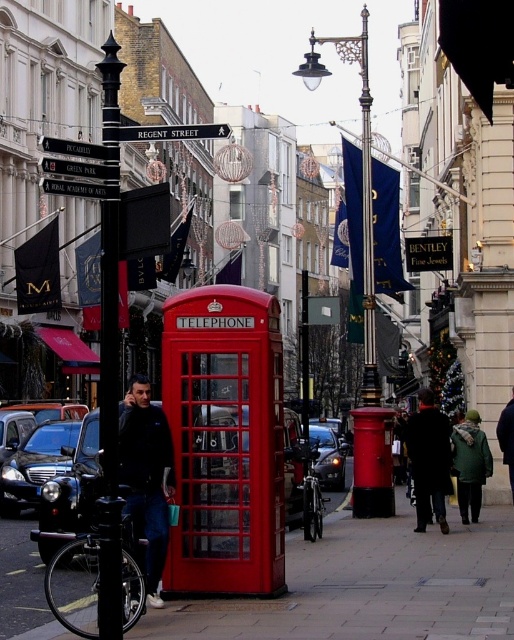
Between point (108, 416) and point (446, 474), which one is positioned in front?

Positioned in front is point (108, 416).

Is black metal pole at left smaller than dark wool coat at center?

Actually, black metal pole at left might be larger than dark wool coat at center.

Is point (102, 573) positioned after point (424, 392)?

No, (102, 573) is in front of (424, 392).

Locate an element on the screen. The image size is (514, 640). black metal pole at left is located at coordinates (108, 432).

In the scene shown: Between dark wool coat at center and metallic silver street sign at upper center, which one appears on the left side from the viewer's perspective?

Positioned to the left is metallic silver street sign at upper center.

Does point (449, 465) come closer to viewer compared to point (78, 145)?

That is False.

Which is behind, point (424, 488) or point (51, 138)?

Point (424, 488)

At what (x,y) coordinates should I click in order to perform the action: click on dark wool coat at center. Please return your answer as a coordinate pair (x, y). The image size is (514, 640). Looking at the image, I should click on (429, 460).

This screenshot has height=640, width=514. What do you see at coordinates (145, 476) in the screenshot?
I see `dark gray sweater at center` at bounding box center [145, 476].

Is point (149, 593) less distant than point (74, 182)?

No.

What do you see at coordinates (145, 476) in the screenshot?
I see `dark gray sweater at center` at bounding box center [145, 476].

I want to click on dark gray sweater at center, so click(145, 476).